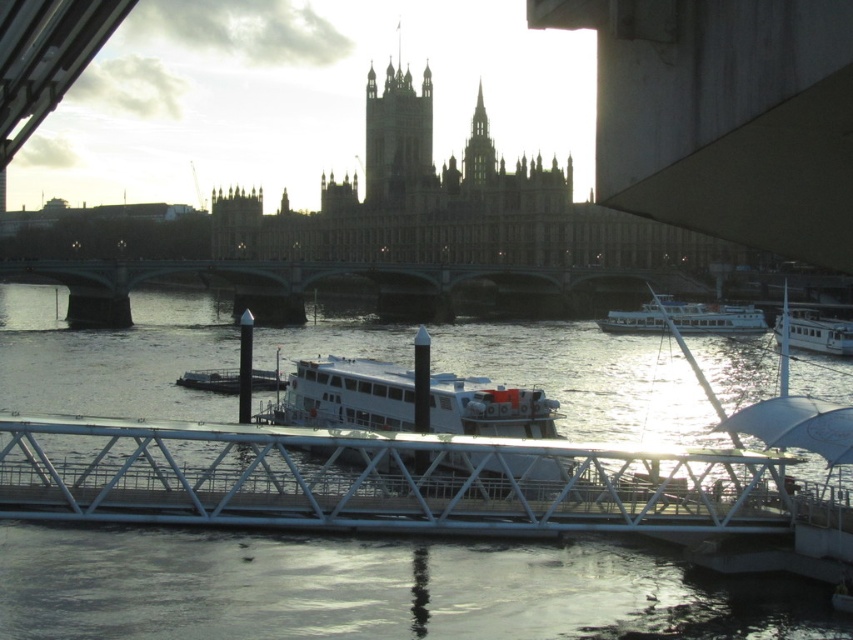
You are a tourist standing on the white metallic bridge at center and want to reach the boat that is docked nearby. The boat is 62.40 meters away from you. If your average walking speed is 1.4 meters per second, how many seconds will it take you to reach the boat?

The boat is 62.40 meters away from the white metallic bridge at center. At a walking speed of 1.4 meters per second, it will take approximately 44.57 seconds to reach the boat.

Looking at this image, you are a tourist standing on the riverbank and want to take a photo of the white metallic bridge at center and the white glossy boat at right. Based on their positions, which object should you frame first in your camera to ensure both are in the shot?

The white metallic bridge at center is below the white glossy boat at right, so you should frame the boat first at the top of the viewfinder and then include the bridge below it to capture both in the photo.